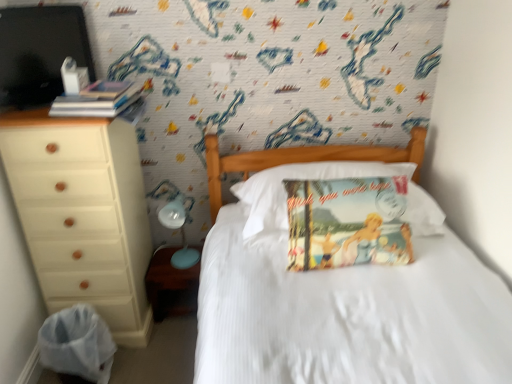
Question: Is white satin bed at center to the right of white plastic bag at lower left from the viewer's perspective?

Choices:
 (A) no
 (B) yes

Answer: (B)

Question: Can you confirm if white satin bed at center is shorter than white plastic bag at lower left?

Choices:
 (A) yes
 (B) no

Answer: (B)

Question: Does white satin bed at center come in front of white plastic bag at lower left?

Choices:
 (A) no
 (B) yes

Answer: (B)

Question: From a real-world perspective, does white satin bed at center sit lower than white plastic bag at lower left?

Choices:
 (A) no
 (B) yes

Answer: (A)

Question: Is white satin bed at center in contact with white plastic bag at lower left?

Choices:
 (A) yes
 (B) no

Answer: (B)

Question: Is white satin bed at center far from white plastic bag at lower left?

Choices:
 (A) yes
 (B) no

Answer: (B)

Question: Is matte brown wood at lower left at the back of vintage paper pillow at center?

Choices:
 (A) no
 (B) yes

Answer: (A)

Question: Is vintage paper pillow at center wider than matte brown wood at lower left?

Choices:
 (A) no
 (B) yes

Answer: (B)

Question: Is vintage paper pillow at center in contact with matte brown wood at lower left?

Choices:
 (A) no
 (B) yes

Answer: (A)

Question: Is vintage paper pillow at center positioned behind matte brown wood at lower left?

Choices:
 (A) yes
 (B) no

Answer: (B)

Question: Can you confirm if vintage paper pillow at center is smaller than matte brown wood at lower left?

Choices:
 (A) yes
 (B) no

Answer: (B)

Question: Is vintage paper pillow at center bigger than matte brown wood at lower left?

Choices:
 (A) no
 (B) yes

Answer: (B)

Question: Can you see light blue plastic table lamp at lower left touching beige wood chest of drawers at left?

Choices:
 (A) no
 (B) yes

Answer: (A)